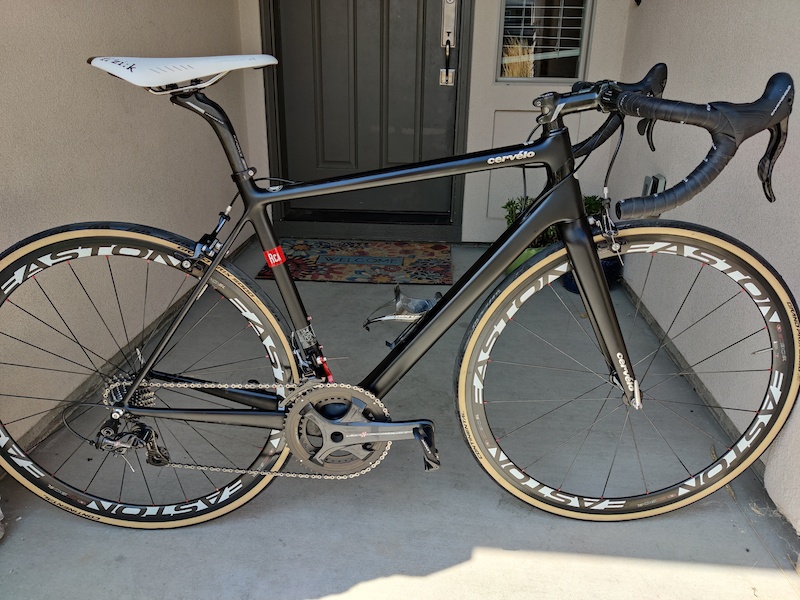
Where is `door`? Image resolution: width=800 pixels, height=600 pixels. door is located at coordinates (350, 80).